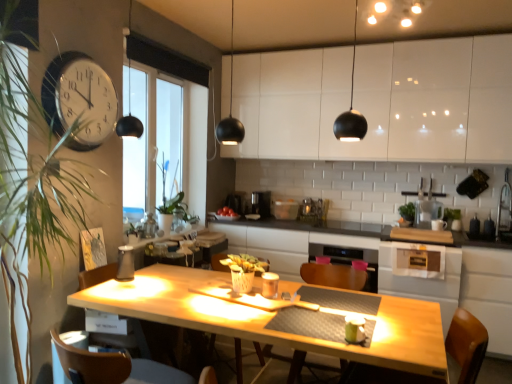
Question: Is black plastic coffee machine at center, the second coffee machine viewed from the left, wider or thinner than brown wood chair at lower left, marked as the 2th chair in a right-to-left arrangement?

Choices:
 (A) thin
 (B) wide

Answer: (A)

Question: Is black plastic coffee machine at center, which is the 1th coffee machine in right-to-left order, in front of or behind brown wood chair at lower left, which ranks as the first chair in left-to-right order, in the image?

Choices:
 (A) front
 (B) behind

Answer: (B)

Question: Considering the real-world distances, which object is farthest from the wooden chair at center?

Choices:
 (A) white glossy clock at upper left
 (B) transparent plastic pitcher at upper right, placed as the first appliance when sorted from right to left
 (C) white glossy cabinets at upper center
 (D) warm matte ceiling lights at upper center
 (E) matte silver kettle at lower left, arranged as the 2th appliance when viewed from the top

Answer: (D)

Question: Which of these objects is positioned closest to the green leafy plant at left, the first plant in the front-to-back sequence?

Choices:
 (A) transparent glass window at center
 (B) brown wood chair at lower left, which ranks as the first chair in left-to-right order
 (C) white glossy clock at upper left
 (D) wooden chair at lower right, which is counted as the 2th chair, starting from the left
 (E) black plastic coffee machine at center, the second coffee machine viewed from the left

Answer: (C)